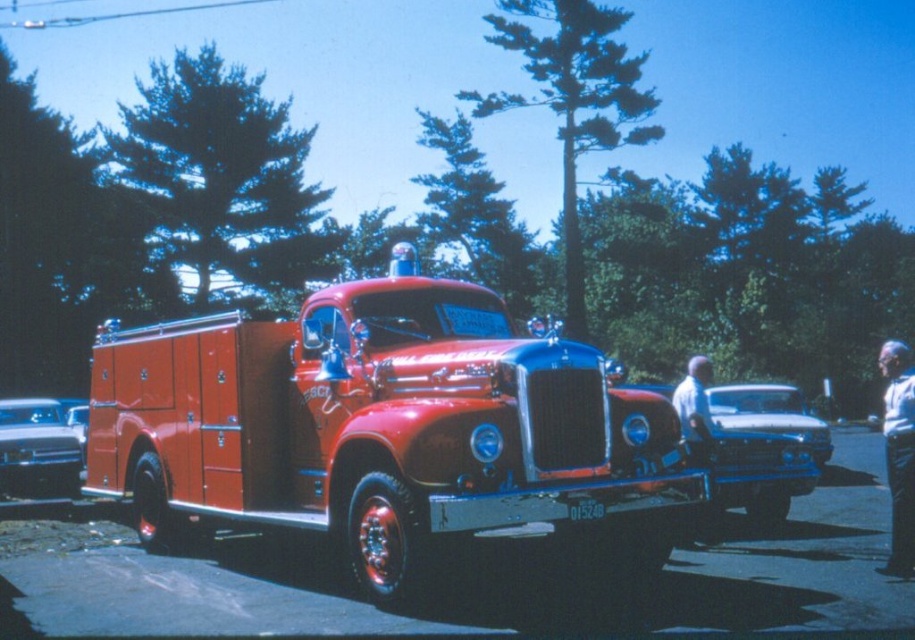
You are a photographer planning to take a picture of the shiny red fire truck at center and the shiny blue car at center. Since both are at the center, how can you ensure both are fully visible in the photo?

The shiny red fire truck at center is in front of the shiny blue car at center, so you should position yourself so that the fire truck is not blocking the view of the car. This way, both vehicles will be fully visible in the photo.

You are a delivery person who needs to unload a package onto the shiny red fire truck at center. However, there is another metallic red fire truck at center nearby. Can you safely maneuver your delivery cart, which is 1.6 meters wide, between them?

The distance between the shiny red fire truck at center and the metallic red fire truck at center is 1.55 meters, which is narrower than your delivery cart of 1.6 meters. Therefore, you cannot safely maneuver your delivery cart between them.

From the picture: You are a photographer trying to capture the shiny red fire truck at center and the metallic red fire truck at center in a single frame. Based on the scene, which one appears higher in the image?

The shiny red fire truck at center appears higher in the image than the metallic red fire truck at center because it is positioned above it.